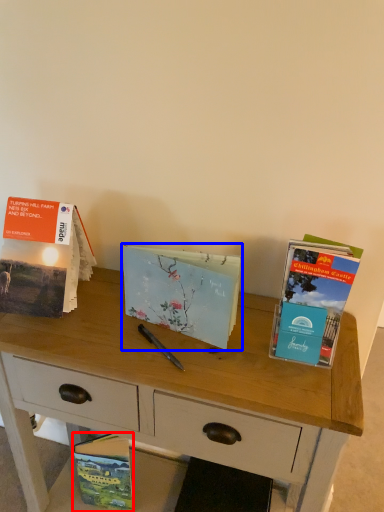
Question: Which of the following is the closest to the observer, book (highlighted by a red box) or book (highlighted by a blue box)?

Choices:
 (A) book
 (B) book

Answer: (B)